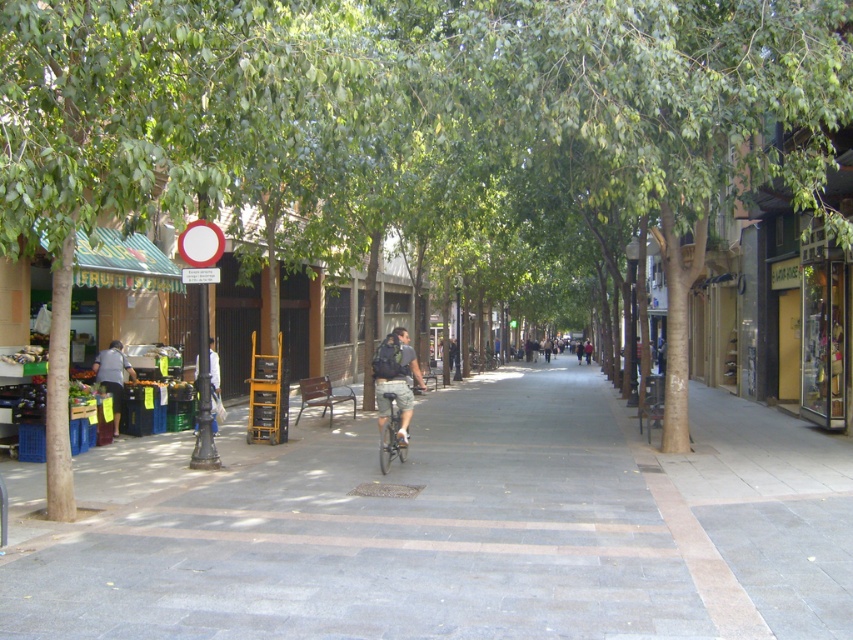
You are a delivery person standing on the gray concrete sidewalk at center and need to place a package on the dark gray backpack at center. Can you reach the backpack without stepping off the sidewalk?

The gray concrete sidewalk at center is closer to the viewer than the dark gray backpack at center, so you can reach the backpack without stepping off the sidewalk.

You are a pedestrian walking along the shaded street and see both the dark gray backpack at center and the white fabric bag at center. Which item is nearer to you?

The dark gray backpack at center is closer to the viewer than the white fabric bag at center.